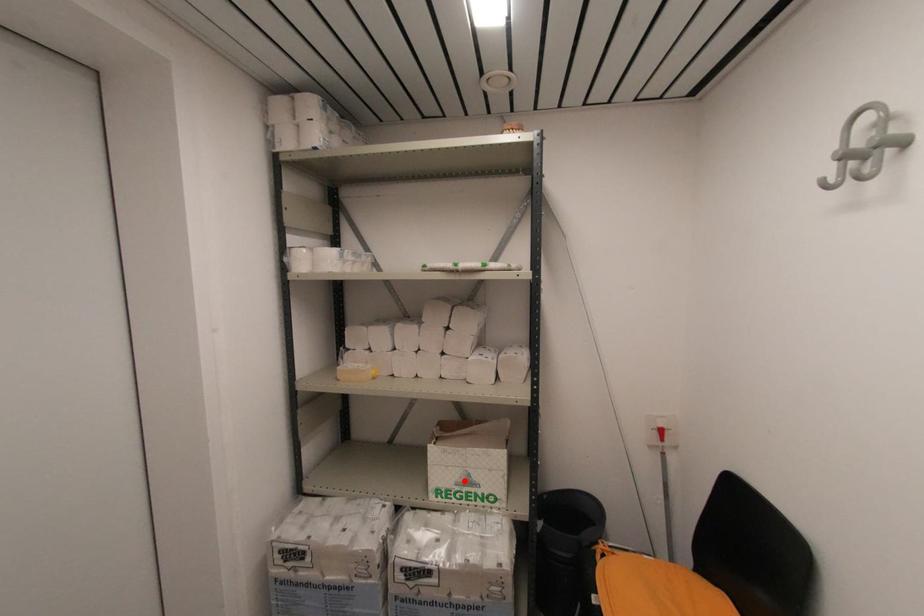
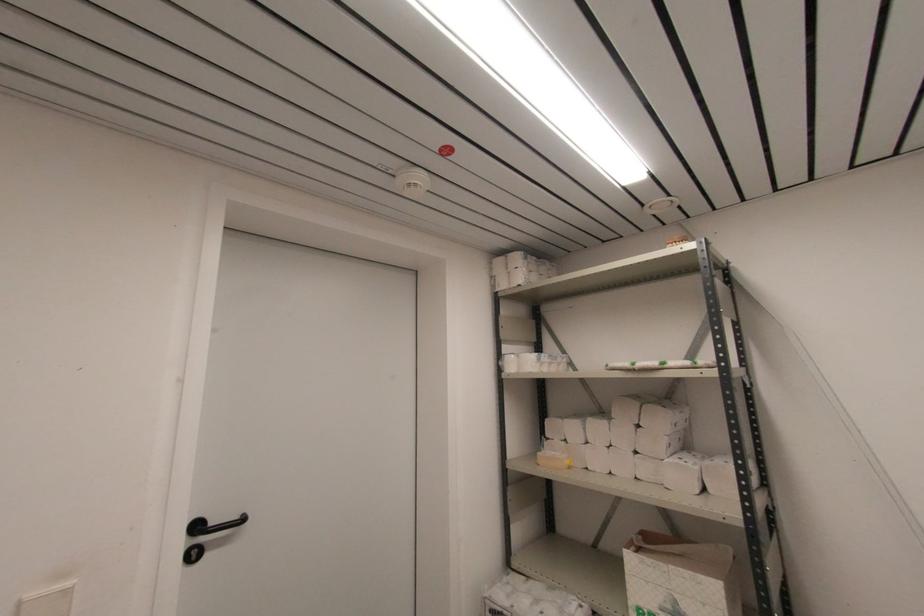
Where in the second image is the point corresponding to the highlighted location from the first image?

(671, 609)